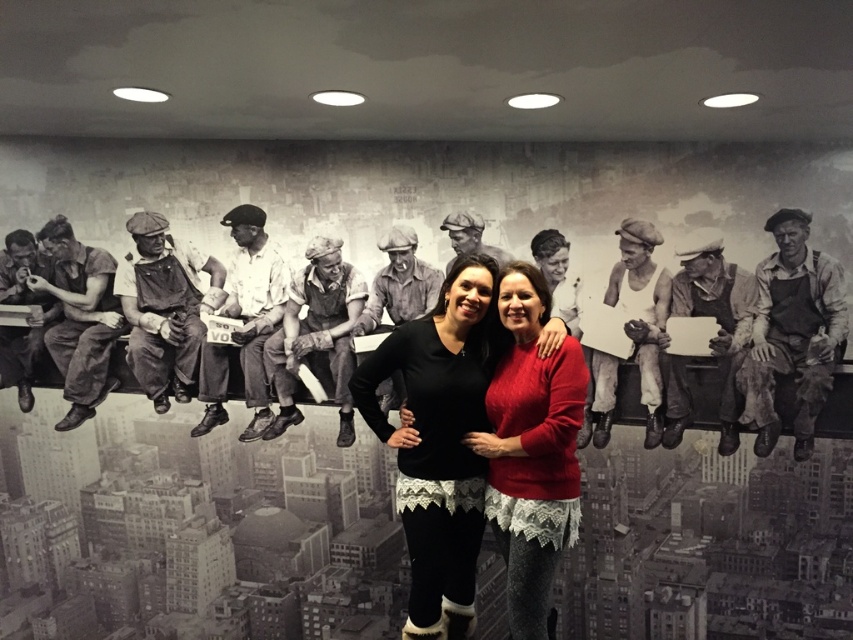
Does matte black overalls at center have a greater width compared to matte black overalls at left?

Correct, the width of matte black overalls at center exceeds that of matte black overalls at left.

Can you confirm if matte black overalls at center is smaller than matte black overalls at left?

Incorrect, matte black overalls at center is not smaller in size than matte black overalls at left.

Where is `matte black overalls at center`? matte black overalls at center is located at coordinates (717, 316).

Identify the location of matte black overalls at center. Image resolution: width=853 pixels, height=640 pixels. (717, 316).

Can you confirm if dark gray fabric overalls at left is positioned to the left of matte gray overalls at center?

Correct, you'll find dark gray fabric overalls at left to the left of matte gray overalls at center.

Is point (100, 328) more distant than point (399, 308)?

Yes, it is.

Who is more forward, (73, 376) or (390, 230)?

Positioned in front is point (390, 230).

Locate an element on the screen. The width and height of the screenshot is (853, 640). dark gray fabric overalls at left is located at coordinates (80, 320).

What do you see at coordinates (161, 307) in the screenshot? Image resolution: width=853 pixels, height=640 pixels. I see `black fabric overalls at left` at bounding box center [161, 307].

Which is in front, point (189, 378) or point (387, 410)?

Point (387, 410) is in front.

Does point (184, 259) come in front of point (415, 288)?

No, (184, 259) is behind (415, 288).

Where is `black fabric overalls at left`? black fabric overalls at left is located at coordinates (161, 307).